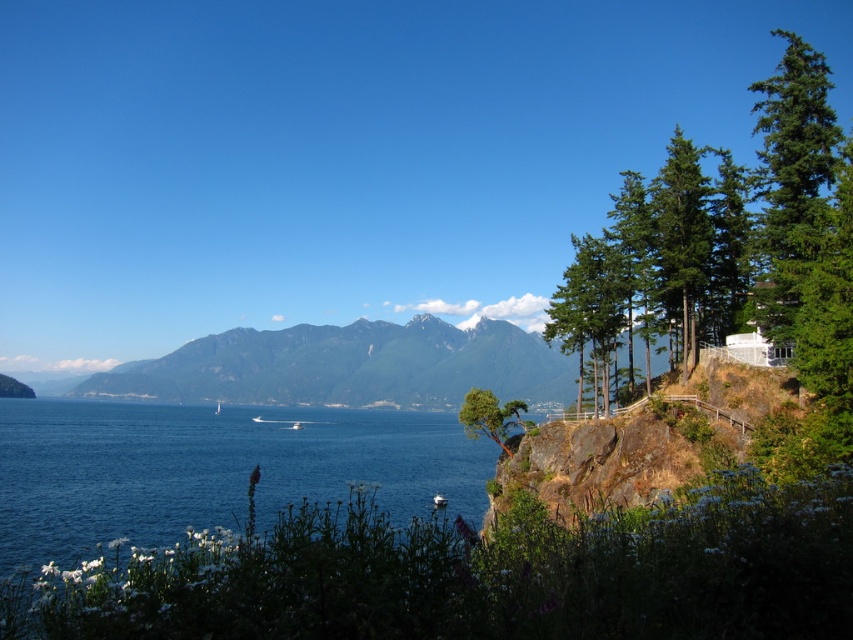
Who is positioned more to the left, blue water at lower left or green rough bark tree at upper right?

From the viewer's perspective, blue water at lower left appears more on the left side.

Describe the element at coordinates (210, 468) in the screenshot. I see `blue water at lower left` at that location.

Locate an element on the screen. The width and height of the screenshot is (853, 640). blue water at lower left is located at coordinates (210, 468).

Can you confirm if blue water at lower left is bigger than rocky gray mountain at center?

Incorrect, blue water at lower left is not larger than rocky gray mountain at center.

Is blue water at lower left shorter than rocky gray mountain at center?

Indeed, blue water at lower left has a lesser height compared to rocky gray mountain at center.

What are the coordinates of `blue water at lower left` in the screenshot? It's located at (210, 468).

Is green textured tree at upper right wider than green rough bark tree at upper right?

No, green textured tree at upper right is not wider than green rough bark tree at upper right.

Who is shorter, green textured tree at upper right or green rough bark tree at upper right?

Standing shorter between the two is green rough bark tree at upper right.

Does point (602, 260) lie in front of point (500, 419)?

Yes, it is.

You are a GUI agent. You are given a task and a screenshot of the screen. Output one action in this format:
    pyautogui.click(x=<x>, y=<y>)
    Task: Click on the green textured tree at upper right
    
    Given the screenshot: What is the action you would take?
    pyautogui.click(x=590, y=310)